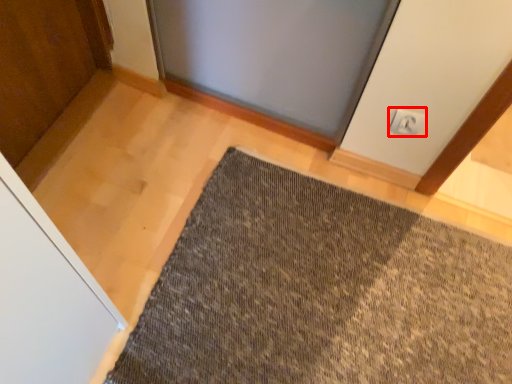
Question: Where is electric outlet (annotated by the red box) located in relation to mat in the image?

Choices:
 (A) left
 (B) right

Answer: (B)